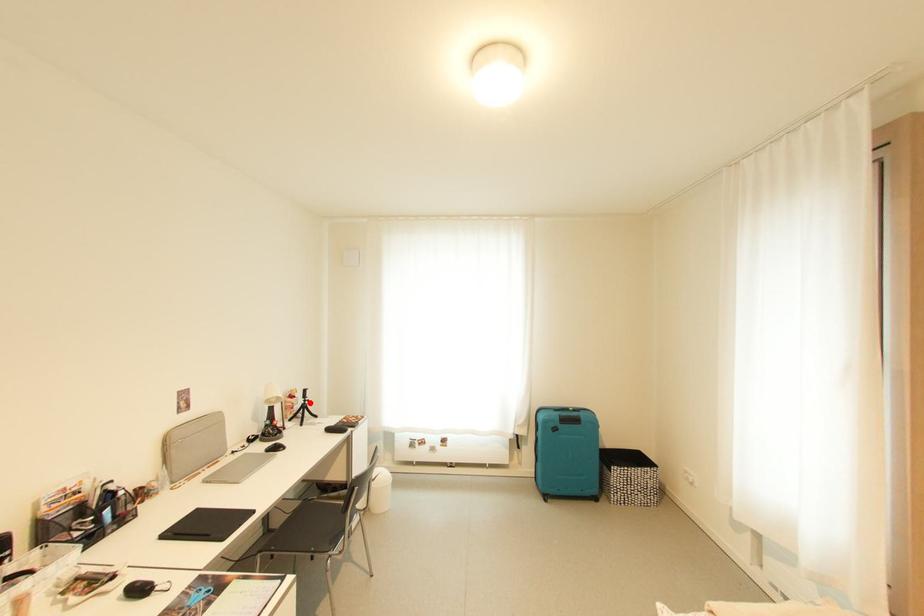
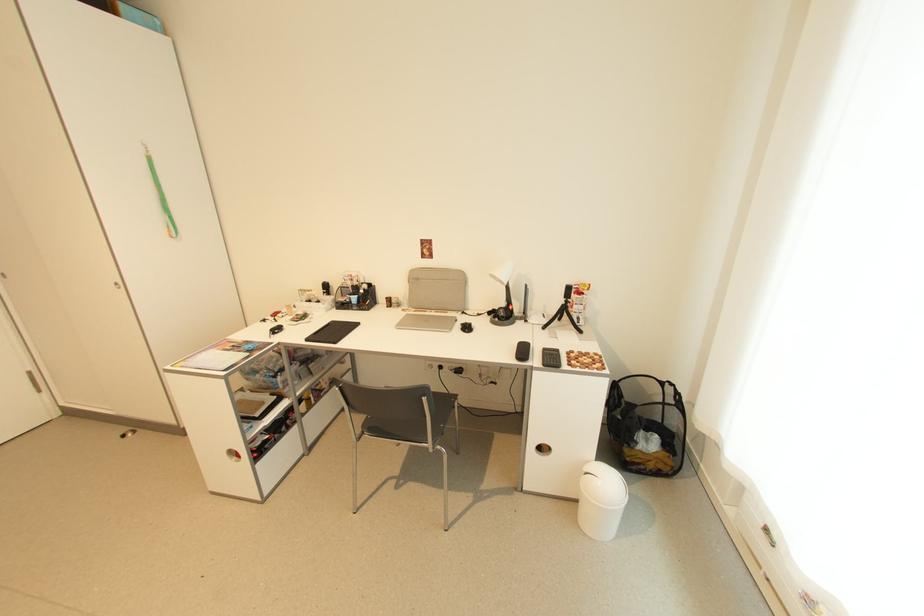
Question: I am providing you with two images of the same scene from different viewpoints. A red point is shown in image1. For the corresponding object point in image2, is it positioned nearer or farther from the camera?

Choices:
 (A) Nearer
 (B) Farther

Answer: (A)